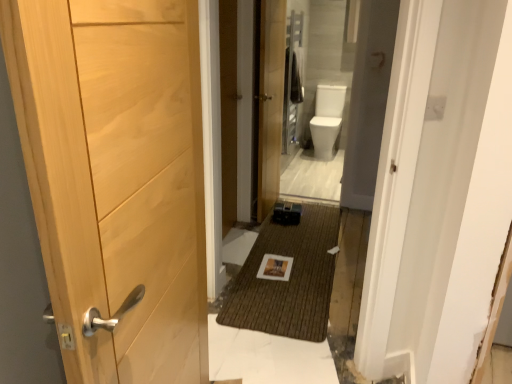
Question: Is point tap(125, 238) closer or farther from the camera than point tap(279, 61)?

Choices:
 (A) closer
 (B) farther

Answer: (A)

Question: From their relative heights in the image, would you say natural wood door at left, positioned as the 2th door in right-to-left order, is taller or shorter than wooden door at center, placed as the second door when sorted from left to right?

Choices:
 (A) short
 (B) tall

Answer: (A)

Question: From the image's perspective, is natural wood door at left, positioned as the first door in front-to-back order, above or below wooden door at center, marked as the 2th door in a front-to-back arrangement?

Choices:
 (A) below
 (B) above

Answer: (A)

Question: From the image's perspective, is wooden door at center, the first door from the back, positioned above or below natural wood door at left, positioned as the first door in front-to-back order?

Choices:
 (A) above
 (B) below

Answer: (A)

Question: From a real-world perspective, is wooden door at center, the first door from the back, above or below natural wood door at left, which appears as the 2th door when viewed from the back?

Choices:
 (A) above
 (B) below

Answer: (B)

Question: In terms of height, does wooden door at center, placed as the second door when sorted from left to right, look taller or shorter compared to natural wood door at left, the 1th door from the left?

Choices:
 (A) tall
 (B) short

Answer: (A)

Question: Based on their sizes in the image, would you say wooden door at center, marked as the 2th door in a front-to-back arrangement, is bigger or smaller than natural wood door at left, which appears as the 2th door when viewed from the back?

Choices:
 (A) big
 (B) small

Answer: (B)